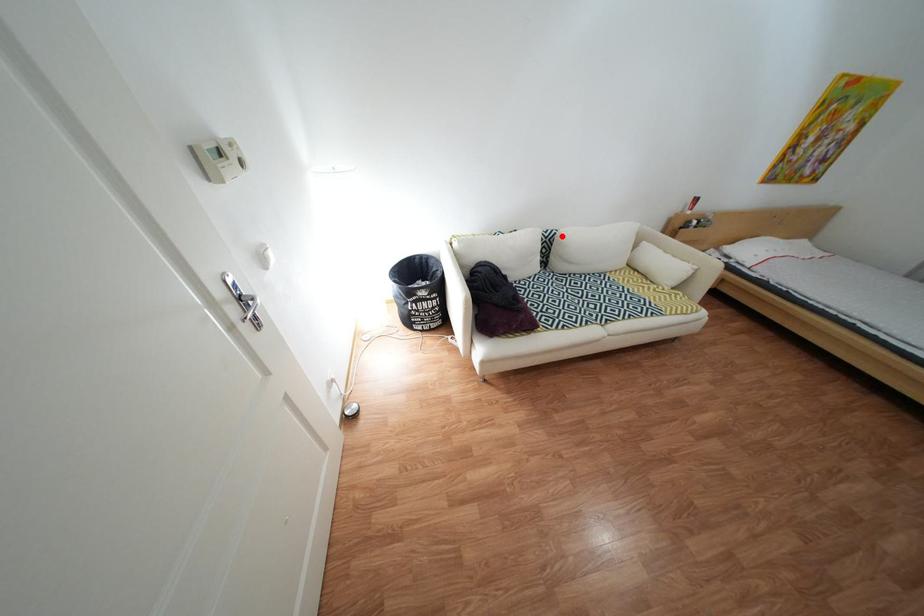
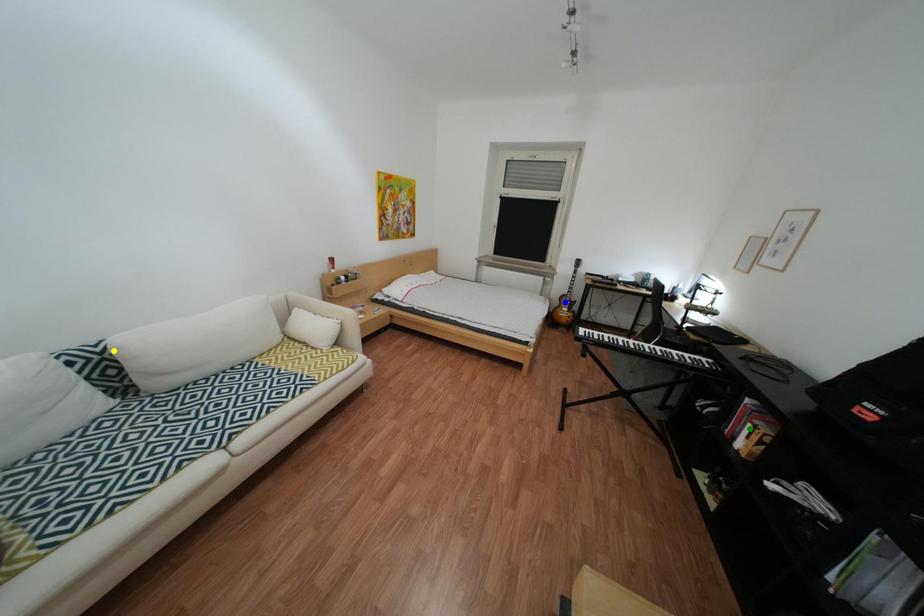
Question: I am providing you with two images of the same scene from different viewpoints. A red point is marked on the first image. You are given multiple points on the second image. Which point in image 2 represents the same 3d spot as the red point in image 1?

Choices:
 (A) green point
 (B) yellow point
 (C) blue point

Answer: (B)